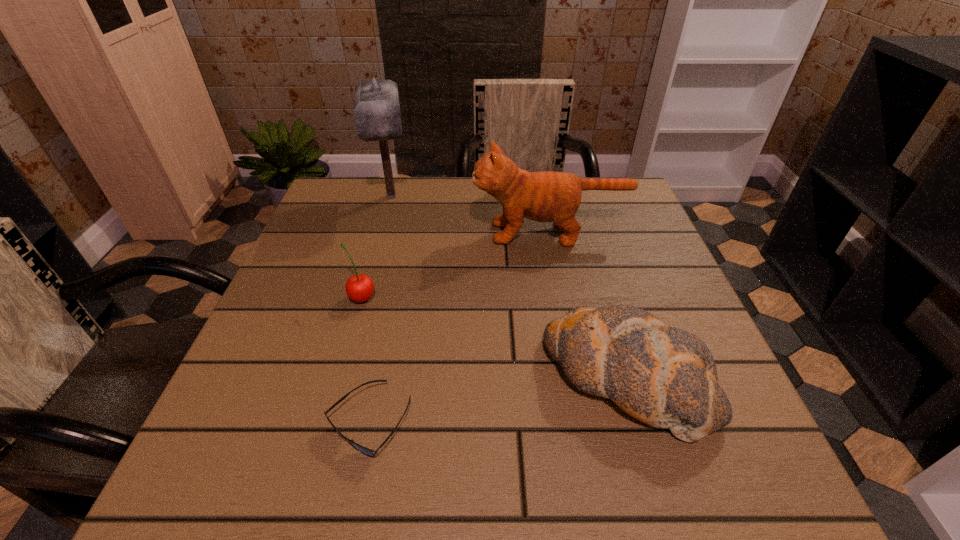
Find the location of a particular element. This screenshot has width=960, height=540. the tallest object is located at coordinates (376, 109).

You are a GUI agent. You are given a task and a screenshot of the screen. Output one action in this format:
    pyautogui.click(x=<x>, y=<y>)
    Task: Click on the farthest object
    
    Given the screenshot: What is the action you would take?
    pyautogui.click(x=376, y=109)

Find the location of a particular element. This screenshot has width=960, height=540. the fourth nearest object is located at coordinates (548, 196).

Locate an element on the screen. cat is located at coordinates (548, 196).

The width and height of the screenshot is (960, 540). What are the coordinates of `the third nearest object` in the screenshot? It's located at [x=359, y=288].

At what (x,y) coordinates should I click in order to perform the action: click on bread. Please return your answer as a coordinate pair (x, y). Looking at the image, I should click on (663, 376).

Locate an element on the screen. sunglasses is located at coordinates (368, 452).

Locate an element on the screen. The image size is (960, 540). vacant area situated 0.390m on the right of the mallet is located at coordinates (564, 197).

The height and width of the screenshot is (540, 960). What are the coordinates of `free region located on the face of the cat` in the screenshot? It's located at (311, 233).

Image resolution: width=960 pixels, height=540 pixels. What are the coordinates of `vacant space located on the face of the cat` in the screenshot? It's located at (367, 233).